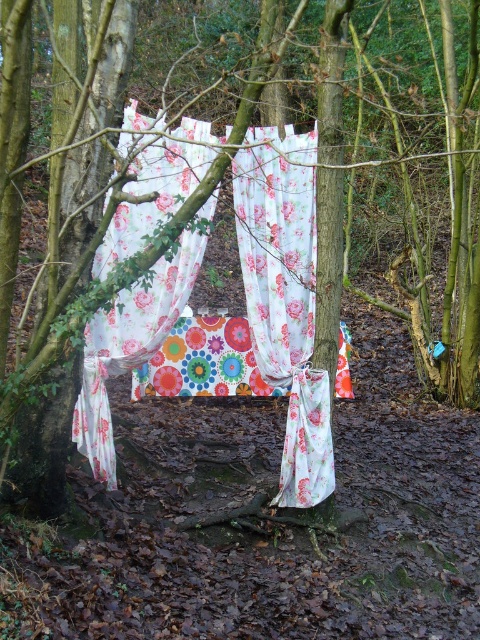
Who is more forward, (291, 422) or (91, 458)?

Point (91, 458) is more forward.

Is floral fabric curtain at center thinner than floral fabric tent at center?

Correct, floral fabric curtain at center's width is less than floral fabric tent at center's.

What are the coordinates of `floral fabric curtain at center` in the screenshot? It's located at (285, 298).